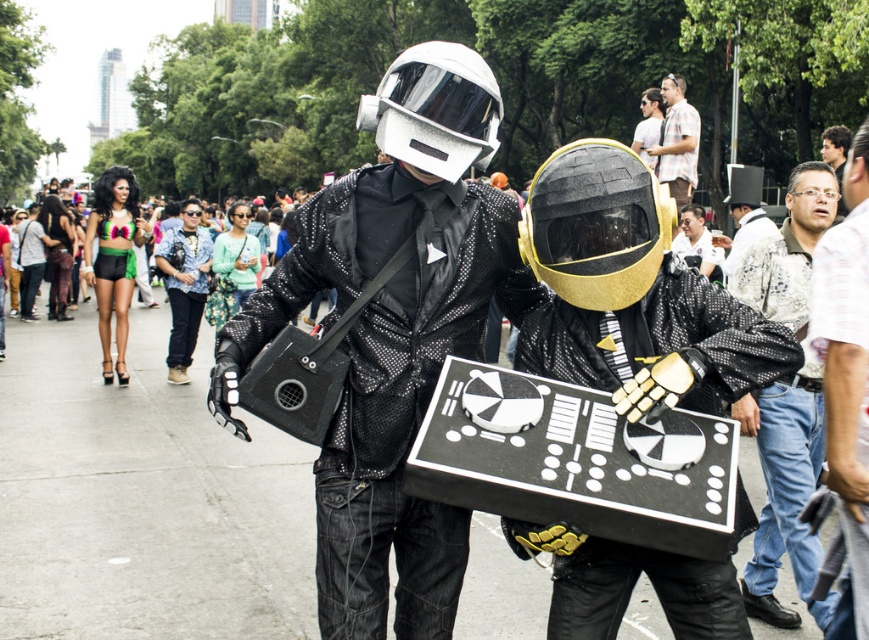
Question: Which object appears closest to the camera in this image?

Choices:
 (A) shiny black jacket at center
 (B) matte black helmet at upper center
 (C) white shirt at right

Answer: (C)

Question: Is light brown leather jacket at right to the left of white shirt at right from the viewer's perspective?

Choices:
 (A) yes
 (B) no

Answer: (B)

Question: Considering the real-world distances, which object is farthest from the white textured top hat at upper center?

Choices:
 (A) matte black helmet at center
 (B) light brown shirt at upper center

Answer: (B)

Question: Estimate the real-world distances between objects in this image. Which object is closer to the matte black helmet at center?

Choices:
 (A) gold textured helmet at center
 (B) white matte helmet at center
 (C) light brown shirt at upper center

Answer: (C)

Question: Is light brown leather jacket at right smaller than white textured top hat at upper center?

Choices:
 (A) yes
 (B) no

Answer: (A)

Question: Is green shiny shorts at center in front of matte black helmet at upper center?

Choices:
 (A) no
 (B) yes

Answer: (B)